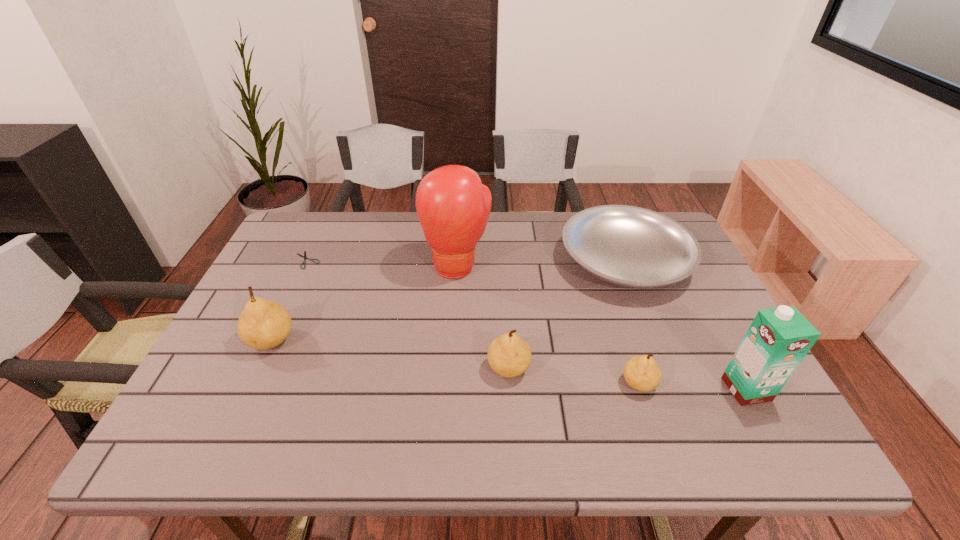
Find the location of a particular element. vacant space situated 0.350m on the back of the tallest pear is located at coordinates (x=318, y=241).

At what (x,y) coordinates should I click in order to perform the action: click on vacant area situated 0.200m on the back of the second pear from right to left. Please return your answer as a coordinate pair (x, y). Looking at the image, I should click on (504, 294).

Where is `vacant space positioned on the back of the shortest pear`? Image resolution: width=960 pixels, height=540 pixels. vacant space positioned on the back of the shortest pear is located at coordinates (614, 308).

Where is `vacant space situated 0.110m on the left of the bedpan`? This screenshot has width=960, height=540. vacant space situated 0.110m on the left of the bedpan is located at coordinates (523, 261).

I want to click on vacant space located 0.370m on the striking surface of the tallest object, so click(449, 403).

What are the coordinates of `vacant area situated on the front of the shortest object` in the screenshot? It's located at (292, 293).

The image size is (960, 540). What are the coordinates of `vacant space located 0.240m on the back of the carton` in the screenshot? It's located at (699, 300).

Image resolution: width=960 pixels, height=540 pixels. Identify the location of bedpan that is positioned at the far edge. (629, 246).

The height and width of the screenshot is (540, 960). I want to click on boxing glove situated at the far edge, so click(453, 206).

At what (x,y) coordinates should I click in order to perform the action: click on shears located at the far edge. Please return your answer as a coordinate pair (x, y). The image size is (960, 540). Looking at the image, I should click on (304, 256).